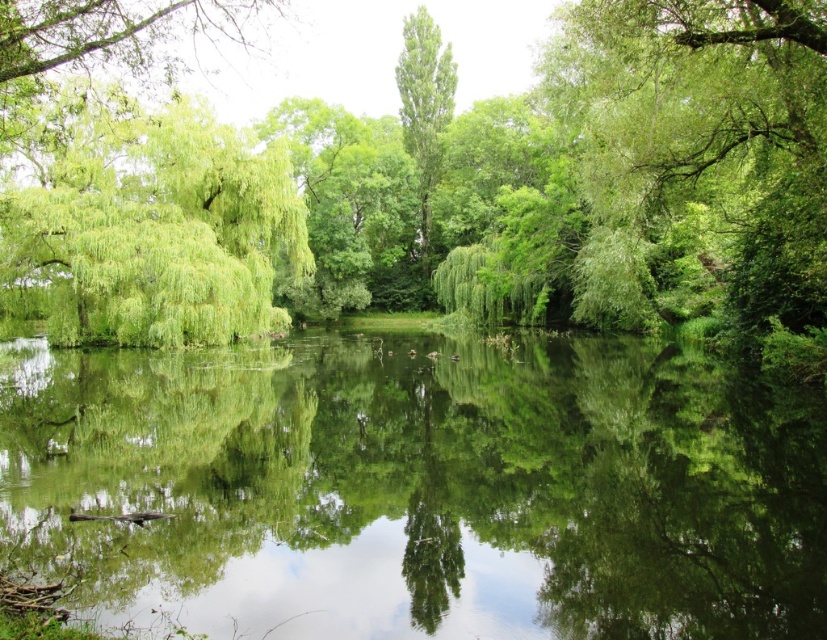
Question: Which of the following is the farthest from the observer?

Choices:
 (A) (429, 388)
 (B) (135, 168)
 (C) (151, 230)
 (D) (436, 289)

Answer: (D)

Question: Which of the following is the farthest from the observer?

Choices:
 (A) green leafy willow at left
 (B) green leafy willow at center
 (C) green reflective water at center
 (D) green leafy tree at center

Answer: (B)

Question: Does green reflective water at center have a smaller size compared to green leafy willow at left?

Choices:
 (A) yes
 (B) no

Answer: (A)

Question: From the image, what is the correct spatial relationship of green reflective water at center in relation to green leafy tree at center?

Choices:
 (A) below
 (B) above

Answer: (A)

Question: Can you confirm if green leafy tree at center is wider than green leafy willow at left?

Choices:
 (A) yes
 (B) no

Answer: (A)

Question: Which is nearer to the green reflective water at center?

Choices:
 (A) green leafy willow at left
 (B) green leafy tree at center
 (C) green leafy willow at center

Answer: (A)